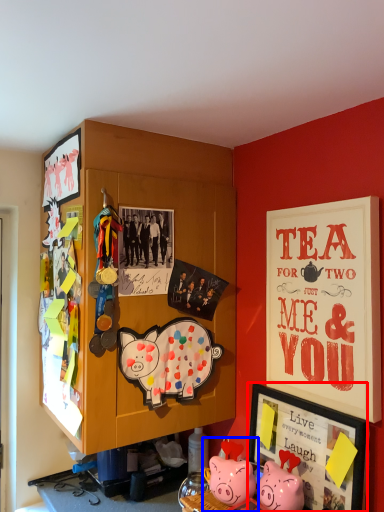
Question: Which object is closer to the camera taking this photo, picture frame (highlighted by a red box) or toy (highlighted by a blue box)?

Choices:
 (A) picture frame
 (B) toy

Answer: (A)